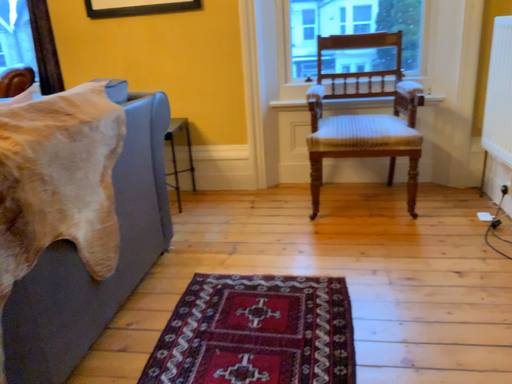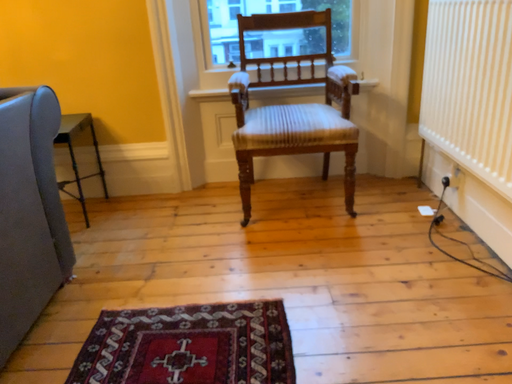
Question: Which way did the camera rotate in the video?

Choices:
 (A) rotated right
 (B) rotated left

Answer: (A)